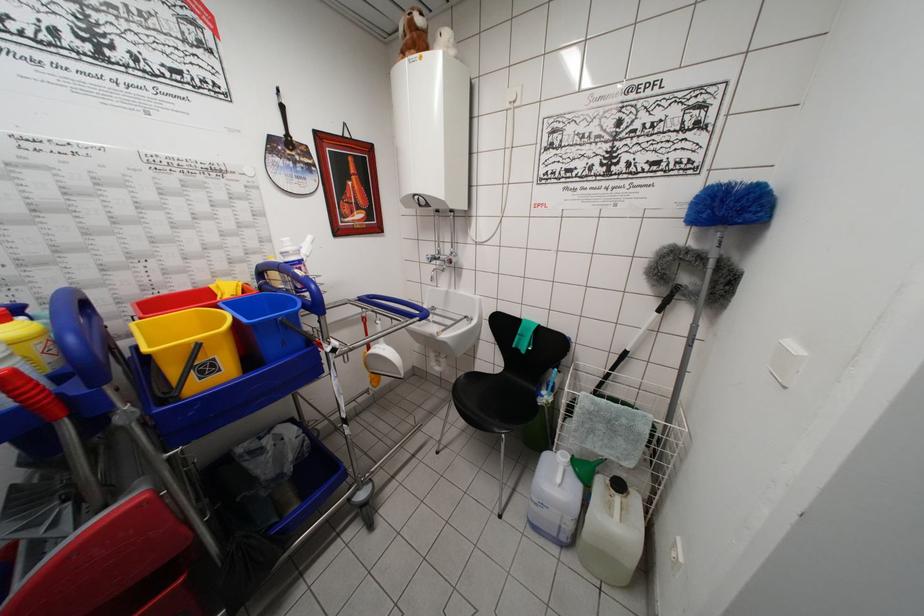
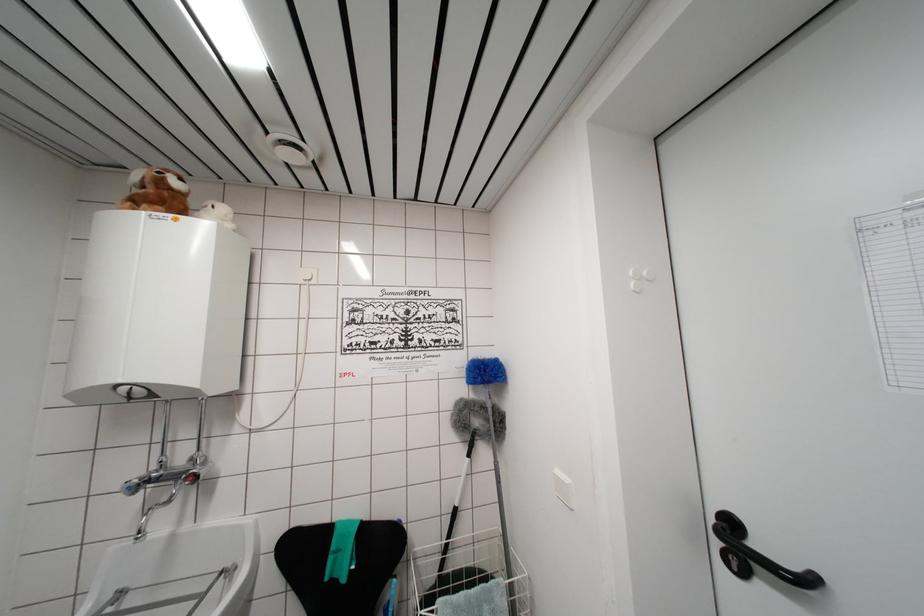
Locate, in the second image, the point that corresponds to [419,52] in the first image.

(168, 209)